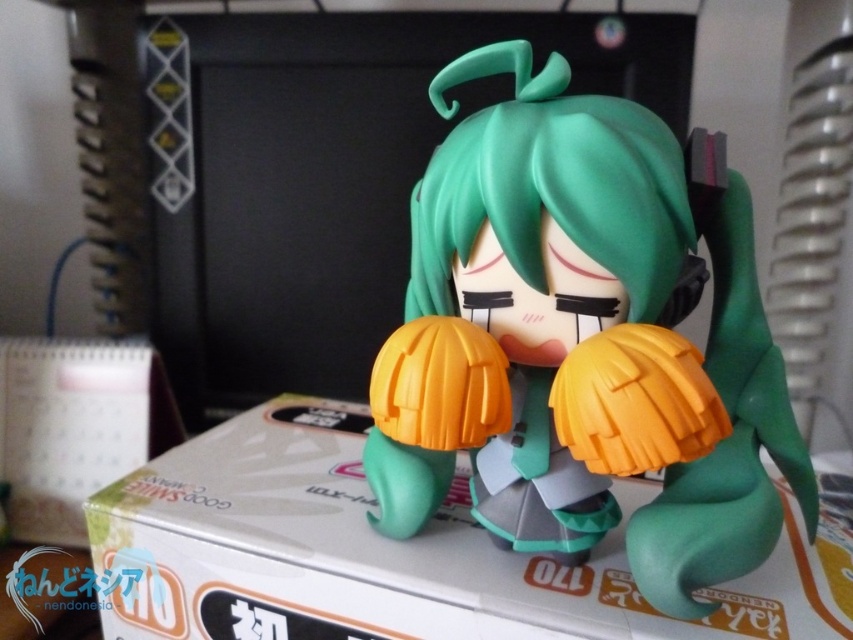
Does matte green figure at center have a greater height compared to white glossy box at lower left?

Correct, matte green figure at center is much taller as white glossy box at lower left.

Identify the location of matte green figure at center. Image resolution: width=853 pixels, height=640 pixels. (579, 342).

Which is in front, point (164, 625) or point (38, 516)?

Point (164, 625)

Who is positioned more to the left, white matte box at center or white glossy box at lower left?

From the viewer's perspective, white glossy box at lower left appears more on the left side.

Where is `white matte box at center`? white matte box at center is located at coordinates (399, 554).

Identify the location of white matte box at center. Image resolution: width=853 pixels, height=640 pixels. 399,554.

Can you confirm if matte green figure at center is positioned above white matte box at center?

Yes.

Does matte green figure at center come in front of white matte box at center?

Yes.

Between point (521, 378) and point (360, 522), which one is positioned behind?

The point (360, 522) is more distant.

Find the location of a particular element. matte green figure at center is located at coordinates (579, 342).